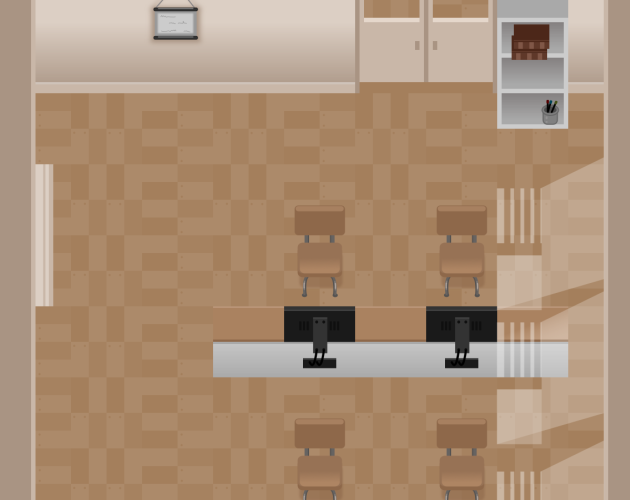
Where is `window ledge`? This screenshot has width=630, height=500. window ledge is located at coordinates (49, 230).